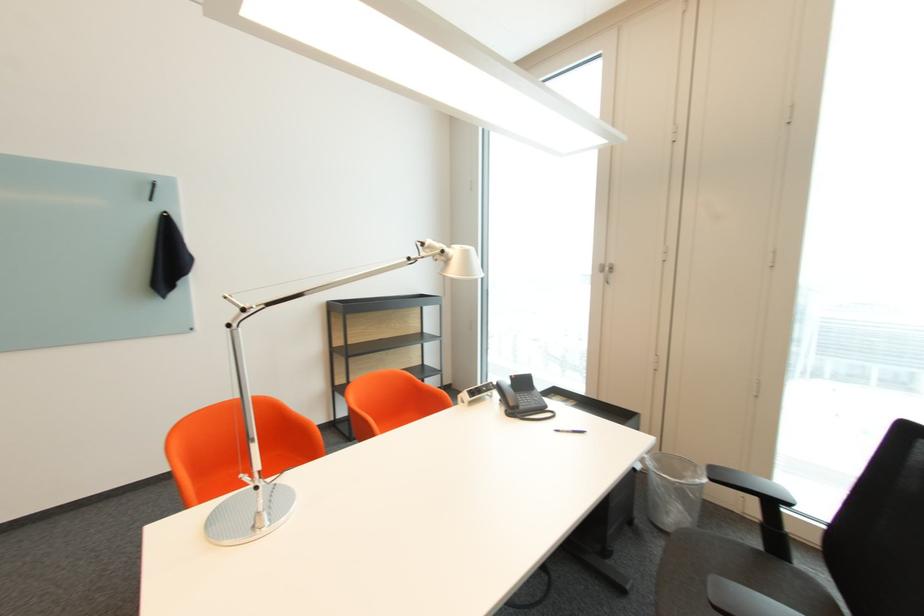
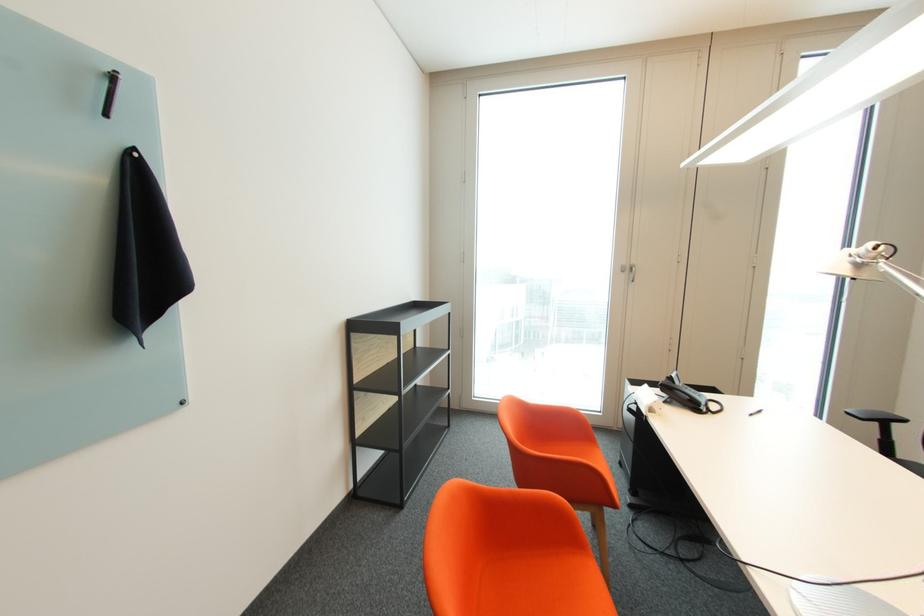
Locate, in the second image, the point that corresponds to the point at 611,272 in the first image.

(629, 272)